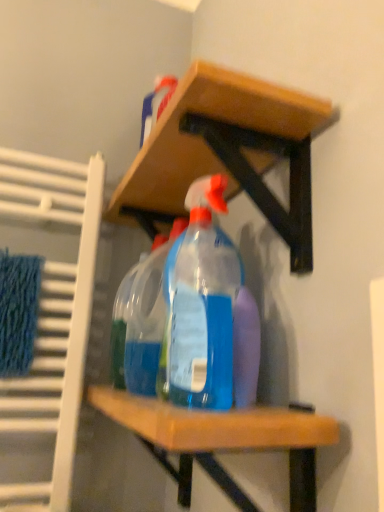
Question: Is transparent plastic spray bottle at center, which ranks as the 1th bottle in back-to-front order, surrounding wooden shelf at upper center?

Choices:
 (A) no
 (B) yes

Answer: (A)

Question: Is transparent plastic spray bottle at center, which ranks as the 1th bottle in back-to-front order, to the left of wooden shelf at upper center from the viewer's perspective?

Choices:
 (A) no
 (B) yes

Answer: (B)

Question: Can you confirm if transparent plastic spray bottle at center, the 2th bottle when ordered from front to back, is bigger than wooden shelf at upper center?

Choices:
 (A) no
 (B) yes

Answer: (A)

Question: Is transparent plastic spray bottle at center, the 2th bottle when ordered from front to back, taller than wooden shelf at upper center?

Choices:
 (A) no
 (B) yes

Answer: (B)

Question: Can you confirm if transparent plastic spray bottle at center, the 2th bottle when ordered from front to back, is wider than wooden shelf at upper center?

Choices:
 (A) yes
 (B) no

Answer: (B)

Question: In terms of height, does wooden shelf at upper center look taller or shorter compared to transparent plastic spray bottle at center, which appears as the second bottle when viewed from the back?

Choices:
 (A) short
 (B) tall

Answer: (A)

Question: Is wooden shelf at upper center wider or thinner than transparent plastic spray bottle at center, marked as the first bottle in a front-to-back arrangement?

Choices:
 (A) wide
 (B) thin

Answer: (A)

Question: Is wooden shelf at upper center spatially inside transparent plastic spray bottle at center, marked as the first bottle in a front-to-back arrangement, or outside of it?

Choices:
 (A) outside
 (B) inside

Answer: (A)

Question: Relative to transparent plastic spray bottle at center, which appears as the second bottle when viewed from the back, is wooden shelf at upper center in front or behind?

Choices:
 (A) front
 (B) behind

Answer: (A)

Question: Is transparent plastic spray bottle at center, marked as the first bottle in a front-to-back arrangement, in front of or behind wooden shelf at upper center in the image?

Choices:
 (A) front
 (B) behind

Answer: (B)

Question: From the image's perspective, relative to wooden shelf at upper center, is transparent plastic spray bottle at center, which appears as the second bottle when viewed from the back, above or below?

Choices:
 (A) below
 (B) above

Answer: (A)

Question: From a real-world perspective, is transparent plastic spray bottle at center, which appears as the second bottle when viewed from the back, physically located above or below wooden shelf at upper center?

Choices:
 (A) below
 (B) above

Answer: (A)

Question: Choose the correct answer: Is transparent plastic spray bottle at center, marked as the first bottle in a front-to-back arrangement, inside wooden shelf at upper center or outside it?

Choices:
 (A) inside
 (B) outside

Answer: (A)

Question: From the image's perspective, is blue knitted bath towel at left positioned above or below transparent plastic spray bottle at center, which ranks as the 1th bottle in back-to-front order?

Choices:
 (A) below
 (B) above

Answer: (A)

Question: Is blue knitted bath towel at left taller or shorter than transparent plastic spray bottle at center, which ranks as the 1th bottle in back-to-front order?

Choices:
 (A) short
 (B) tall

Answer: (A)